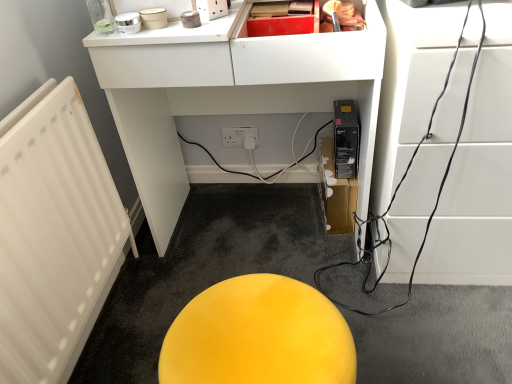
Question: From a real-world perspective, is yellow matte stool at center, which appears as the second furniture when viewed from the right, under matte black computer tower at lower center, the 3th furniture from the right?

Choices:
 (A) no
 (B) yes

Answer: (B)

Question: Is yellow matte stool at center, which is counted as the second furniture, starting from the left, outside matte black computer tower at lower center, the 3th furniture from the right?

Choices:
 (A) yes
 (B) no

Answer: (A)

Question: Is yellow matte stool at center, which is counted as the second furniture, starting from the left, closer to camera compared to matte black computer tower at lower center, the 3th furniture from the right?

Choices:
 (A) no
 (B) yes

Answer: (B)

Question: Is yellow matte stool at center, which is counted as the second furniture, starting from the left, thinner than matte black computer tower at lower center, which is the first furniture from left to right?

Choices:
 (A) no
 (B) yes

Answer: (B)

Question: Is yellow matte stool at center, which appears as the second furniture when viewed from the right, aimed at matte black computer tower at lower center, the 3th furniture from the right?

Choices:
 (A) no
 (B) yes

Answer: (A)

Question: Is yellow matte stool at center, which appears as the second furniture when viewed from the right, bigger than matte black computer tower at lower center, which is the first furniture from left to right?

Choices:
 (A) no
 (B) yes

Answer: (A)

Question: Does black glossy cable at right, which appears as the third furniture when viewed from the left, contain yellow matte stool at center, which is counted as the second furniture, starting from the left?

Choices:
 (A) no
 (B) yes

Answer: (A)

Question: From the image's perspective, is black glossy cable at right, which appears as the third furniture when viewed from the left, below yellow matte stool at center, which is counted as the second furniture, starting from the left?

Choices:
 (A) no
 (B) yes

Answer: (A)

Question: Is black glossy cable at right, the 1th furniture positioned from the right, facing towards yellow matte stool at center, which appears as the second furniture when viewed from the right?

Choices:
 (A) yes
 (B) no

Answer: (B)

Question: Does black glossy cable at right, the 1th furniture positioned from the right, have a greater width compared to yellow matte stool at center, which is counted as the second furniture, starting from the left?

Choices:
 (A) yes
 (B) no

Answer: (A)

Question: From the image's perspective, would you say black glossy cable at right, which appears as the third furniture when viewed from the left, is positioned over yellow matte stool at center, which is counted as the second furniture, starting from the left?

Choices:
 (A) no
 (B) yes

Answer: (B)

Question: Is black glossy cable at right, the 1th furniture positioned from the right, turned away from yellow matte stool at center, which appears as the second furniture when viewed from the right?

Choices:
 (A) no
 (B) yes

Answer: (A)

Question: From the image's perspective, is matte black computer tower at lower center, the 3th furniture from the right, beneath yellow matte stool at center, which appears as the second furniture when viewed from the right?

Choices:
 (A) yes
 (B) no

Answer: (B)